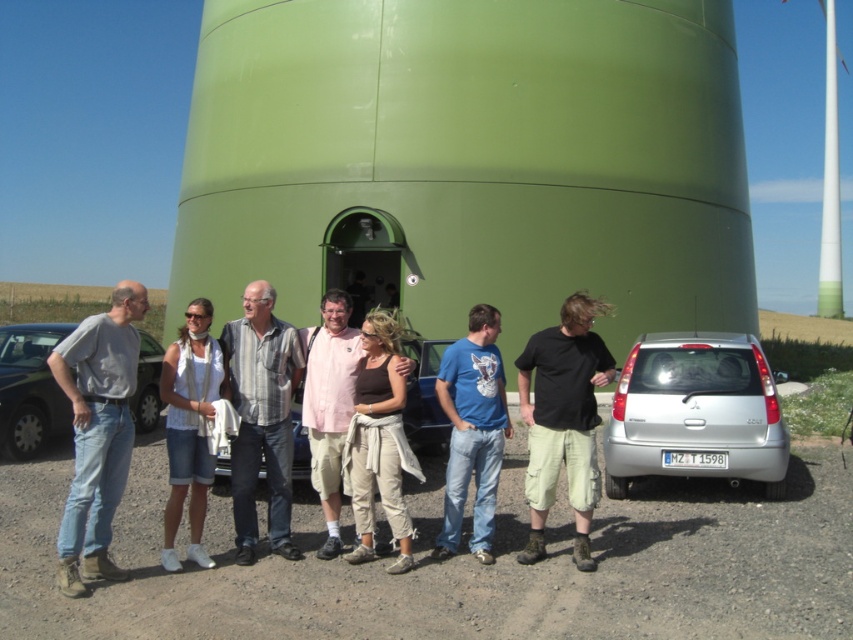
Who is more forward, (x=503, y=397) or (x=207, y=483)?

Point (x=207, y=483) is in front.

Which is behind, point (474, 323) or point (178, 508)?

Point (474, 323)

This screenshot has height=640, width=853. In order to click on blue cotton t-shirt at center in this screenshot , I will do [x=473, y=429].

Does point (722, 440) come closer to viewer compared to point (399, 560)?

No, it is behind (399, 560).

Does silver metallic hatchback at lower right have a greater height compared to dark brown leather pants at center?

In fact, silver metallic hatchback at lower right may be shorter than dark brown leather pants at center.

At what (x,y) coordinates should I click in order to perform the action: click on silver metallic hatchback at lower right. Please return your answer as a coordinate pair (x, y). This screenshot has height=640, width=853. Looking at the image, I should click on (695, 412).

Consider the image. Can you confirm if black cotton shirt at center is positioned to the right of metallic blue sedan at center?

Indeed, black cotton shirt at center is positioned on the right side of metallic blue sedan at center.

Who is positioned more to the left, black cotton shirt at center or metallic blue sedan at center?

From the viewer's perspective, metallic blue sedan at center appears more on the left side.

You are a GUI agent. You are given a task and a screenshot of the screen. Output one action in this format:
    pyautogui.click(x=<x>, y=<y>)
    Task: Click on the black cotton shirt at center
    The height and width of the screenshot is (640, 853).
    Given the screenshot: What is the action you would take?
    pyautogui.click(x=563, y=419)